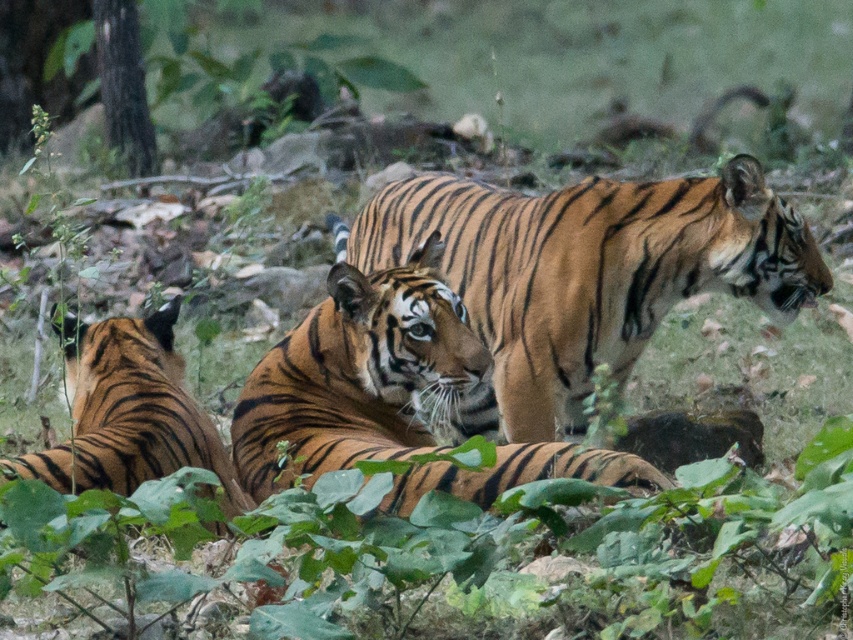
Is the position of orange-brown striped tiger at center more distant than that of orange striped tiger at center?

Yes, orange-brown striped tiger at center is behind orange striped tiger at center.

At what (x,y) coordinates should I click in order to perform the action: click on orange-brown striped tiger at center. Please return your answer as a coordinate pair (x, y). The width and height of the screenshot is (853, 640). Looking at the image, I should click on (585, 273).

Can you confirm if orange-brown striped tiger at center is smaller than orange striped tiger at lower left?

No, orange-brown striped tiger at center is not smaller than orange striped tiger at lower left.

Is point (762, 273) less distant than point (146, 326)?

Yes, it is.

Who is more distant from viewer, (x=368, y=268) or (x=201, y=426)?

Point (x=368, y=268)

At what (x,y) coordinates should I click in order to perform the action: click on orange-brown striped tiger at center. Please return your answer as a coordinate pair (x, y). The width and height of the screenshot is (853, 640). Looking at the image, I should click on (585, 273).

Can you confirm if green leafy foliage at center is positioned above orange striped tiger at lower left?

Actually, green leafy foliage at center is below orange striped tiger at lower left.

Between green leafy foliage at center and orange striped tiger at lower left, which one is positioned lower?

Positioned lower is green leafy foliage at center.

This screenshot has width=853, height=640. What are the coordinates of `green leafy foliage at center` in the screenshot? It's located at (556, 547).